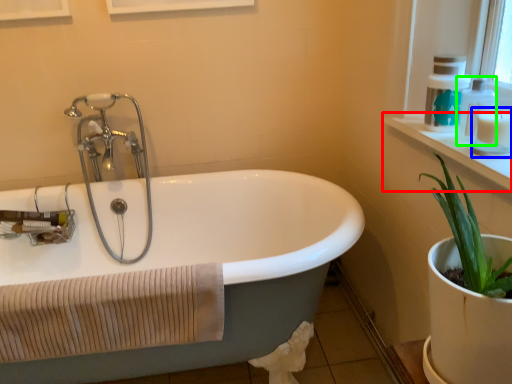
Question: Which is farther away from window sill (highlighted by a red box)? toiletry (highlighted by a blue box) or soap dispenser (highlighted by a green box)?

Choices:
 (A) toiletry
 (B) soap dispenser

Answer: (A)